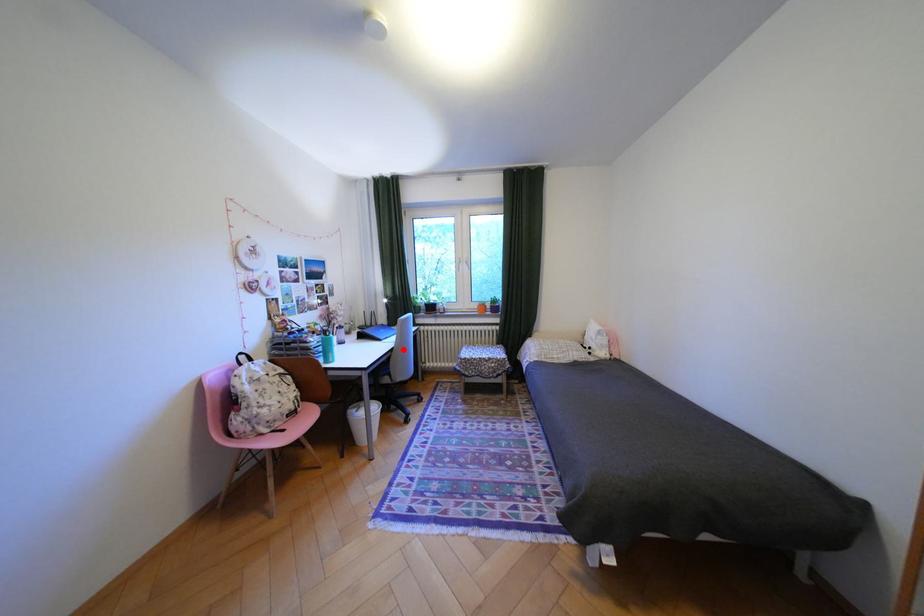
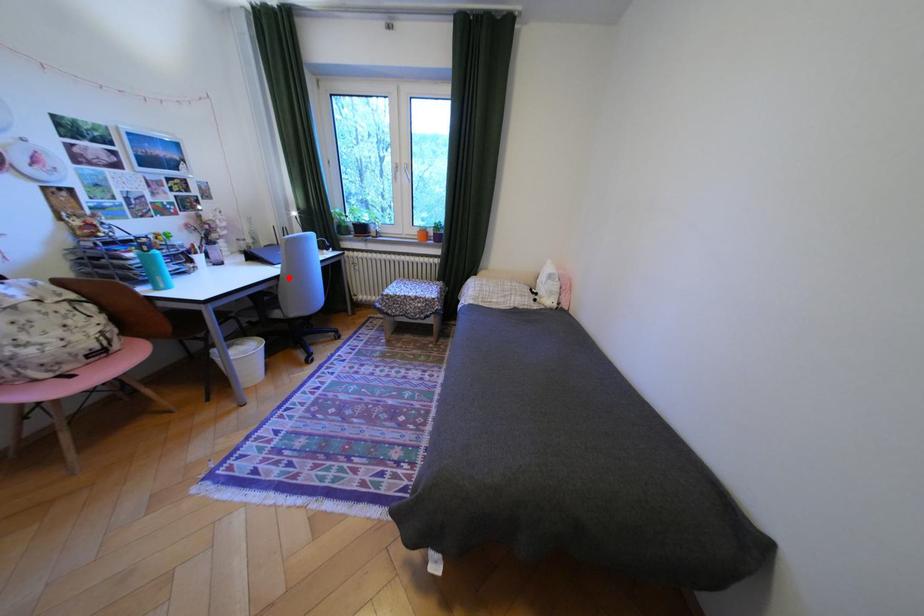
I am providing you with two images of the same scene from different viewpoints. A red point is marked on the first image and another point is marked on the second image. Are the points marked in image1 and image2 representing the same 3D position?

Yes